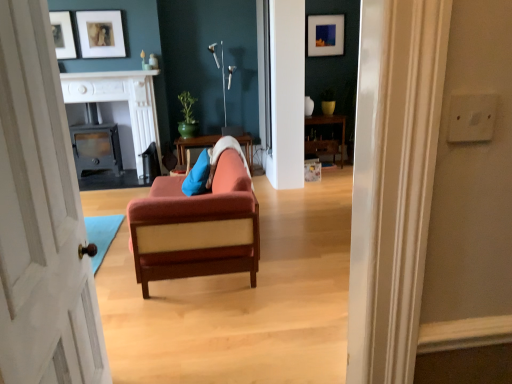
Question: Is matte black picture frame at upper center, placed as the 1th picture frame when sorted from right to left, not inside wooden table at center?

Choices:
 (A) yes
 (B) no

Answer: (A)

Question: Is matte black picture frame at upper center, placed as the 1th picture frame when sorted from right to left, in front of wooden table at center?

Choices:
 (A) no
 (B) yes

Answer: (A)

Question: Can you confirm if matte black picture frame at upper center, marked as the third picture frame in a front-to-back arrangement, is shorter than wooden table at center?

Choices:
 (A) yes
 (B) no

Answer: (B)

Question: Is matte black picture frame at upper center, placed as the 1th picture frame when sorted from right to left, to the right of wooden table at center from the viewer's perspective?

Choices:
 (A) no
 (B) yes

Answer: (B)

Question: Considering the relative positions of matte black picture frame at upper center, placed as the 1th picture frame when sorted from right to left, and wooden table at center in the image provided, is matte black picture frame at upper center, placed as the 1th picture frame when sorted from right to left, behind wooden table at center?

Choices:
 (A) no
 (B) yes

Answer: (B)

Question: Considering their positions, is wooden dresser at center located in front of or behind blue fabric pillow at center?

Choices:
 (A) behind
 (B) front

Answer: (A)

Question: Based on their positions, is wooden dresser at center located to the left or right of blue fabric pillow at center?

Choices:
 (A) left
 (B) right

Answer: (B)

Question: From a real-world perspective, is wooden dresser at center above or below blue fabric pillow at center?

Choices:
 (A) below
 (B) above

Answer: (A)

Question: In terms of height, does wooden dresser at center look taller or shorter compared to blue fabric pillow at center?

Choices:
 (A) tall
 (B) short

Answer: (A)

Question: Which is correct: wooden table at center is inside green glossy pot at upper center, or outside of it?

Choices:
 (A) outside
 (B) inside

Answer: (A)

Question: Is point (174, 142) closer or farther from the camera than point (178, 124)?

Choices:
 (A) closer
 (B) farther

Answer: (A)

Question: From the image's perspective, is wooden table at center located above or below green glossy pot at upper center?

Choices:
 (A) above
 (B) below

Answer: (B)

Question: From their relative heights in the image, would you say wooden table at center is taller or shorter than green glossy pot at upper center?

Choices:
 (A) tall
 (B) short

Answer: (B)

Question: From the image's perspective, is blue fabric pillow at center above or below green glossy pot at upper center?

Choices:
 (A) above
 (B) below

Answer: (B)

Question: Does point (198, 160) appear closer or farther from the camera than point (190, 137)?

Choices:
 (A) farther
 (B) closer

Answer: (B)